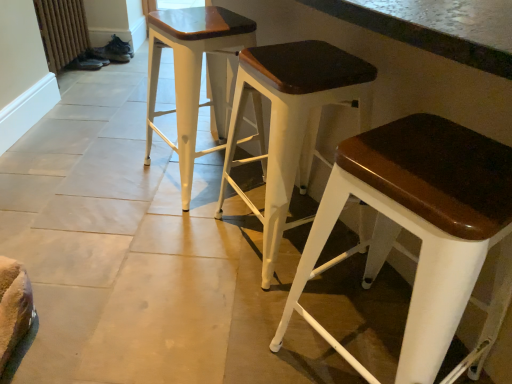
The height and width of the screenshot is (384, 512). Find the location of `rustic wood radiator at lower left`. rustic wood radiator at lower left is located at coordinates (62, 31).

What do you see at coordinates (194, 75) in the screenshot?
I see `white wood stool at center, the first stool when ordered from left to right` at bounding box center [194, 75].

Image resolution: width=512 pixels, height=384 pixels. What are the coordinates of `white wood stool at center, the 3th stool in the left-to-right sequence` in the screenshot? It's located at (420, 229).

Does point (346, 143) come behind point (51, 1)?

No, it is not.

Measure the distance from white wood stool at center, the 3th stool in the left-to-right sequence, to rustic wood radiator at lower left.

white wood stool at center, the 3th stool in the left-to-right sequence, is 7.20 feet away from rustic wood radiator at lower left.

How many degrees apart are the facing directions of white wood stool at center, the 3th stool in the left-to-right sequence, and rustic wood radiator at lower left?

40.2 degrees.

Are white wood stool at center, the 3th stool in the left-to-right sequence, and rustic wood radiator at lower left located far from each other?

Yes.

Is white wood stool at center, the 3th stool in the right-to-left sequence, closer to camera compared to white wood stool at center, the 3th stool in the left-to-right sequence?

No, white wood stool at center, the 3th stool in the right-to-left sequence, is behind white wood stool at center, the 3th stool in the left-to-right sequence.

Find the location of `stool that is the 2nd one when counting forward from the white wood stool at center, the first stool when ordered from left to right`. stool that is the 2nd one when counting forward from the white wood stool at center, the first stool when ordered from left to right is located at coordinates (420, 229).

In the scene shown: Can you tell me how much white wood stool at center, the 3th stool in the right-to-left sequence, and white wood stool at center, the first stool viewed from the right, differ in facing direction?

2.34 degrees separate the facing orientations of white wood stool at center, the 3th stool in the right-to-left sequence, and white wood stool at center, the first stool viewed from the right.

Are white wood stool at center, the 3th stool in the right-to-left sequence, and white wood stool at center, the first stool viewed from the right, beside each other?

No, white wood stool at center, the 3th stool in the right-to-left sequence, is not in contact with white wood stool at center, the first stool viewed from the right.

Between matte white stool at center, which is the second stool from left to right, and white wood stool at center, the first stool viewed from the right, which one has less height?

white wood stool at center, the first stool viewed from the right.

Is point (314, 66) positioned behind point (444, 261)?

That is True.

From the image's perspective, is matte white stool at center, acting as the 2th stool starting from the right, under white wood stool at center, the 3th stool in the left-to-right sequence?

Incorrect, from the image's perspective, matte white stool at center, acting as the 2th stool starting from the right, is higher than white wood stool at center, the 3th stool in the left-to-right sequence.

From a real-world perspective, is matte white stool at center, acting as the 2th stool starting from the right, on white wood stool at center, the first stool viewed from the right?

Yes, from a real-world perspective, matte white stool at center, acting as the 2th stool starting from the right, is over white wood stool at center, the first stool viewed from the right

From a real-world perspective, is white wood stool at center, the first stool viewed from the right, located higher than matte white stool at center, acting as the 2th stool starting from the right?

No, from a real-world perspective, white wood stool at center, the first stool viewed from the right, is not over matte white stool at center, acting as the 2th stool starting from the right

Between white wood stool at center, the 3th stool in the left-to-right sequence, and matte white stool at center, which is the second stool from left to right, which one has larger width?

Wider between the two is white wood stool at center, the 3th stool in the left-to-right sequence.

Consider the image. Is white wood stool at center, the first stool viewed from the right, positioned with its back to matte white stool at center, acting as the 2th stool starting from the right?

No, matte white stool at center, acting as the 2th stool starting from the right, is not at the back of white wood stool at center, the first stool viewed from the right.

Would you say white wood stool at center, the 3th stool in the left-to-right sequence, is outside matte white stool at center, which is the second stool from left to right?

That's correct, white wood stool at center, the 3th stool in the left-to-right sequence, is outside of matte white stool at center, which is the second stool from left to right.

Can you confirm if rustic wood radiator at lower left is thinner than white wood stool at center, the first stool viewed from the right?

Correct, the width of rustic wood radiator at lower left is less than that of white wood stool at center, the first stool viewed from the right.

From a real-world perspective, which is physically above, rustic wood radiator at lower left or white wood stool at center, the 3th stool in the left-to-right sequence?

In real-world perspective, white wood stool at center, the 3th stool in the left-to-right sequence, is above.

Considering the sizes of objects rustic wood radiator at lower left and white wood stool at center, the 3th stool in the left-to-right sequence, in the image provided, who is taller, rustic wood radiator at lower left or white wood stool at center, the 3th stool in the left-to-right sequence,?

white wood stool at center, the 3th stool in the left-to-right sequence, is taller.

Locate an element on the screen. radiator located behind the white wood stool at center, the first stool viewed from the right is located at coordinates (62, 31).

In the scene shown: Is white wood stool at center, the first stool viewed from the right, oriented away from white wood stool at center, the first stool when ordered from left to right?

No, white wood stool at center, the first stool viewed from the right, is not facing the opposite direction of white wood stool at center, the first stool when ordered from left to right.

Considering the positions of objects white wood stool at center, the first stool viewed from the right, and white wood stool at center, the first stool when ordered from left to right, in the image provided, who is in front, white wood stool at center, the first stool viewed from the right, or white wood stool at center, the first stool when ordered from left to right,?

white wood stool at center, the first stool viewed from the right, is in front.

Measure the distance from white wood stool at center, the first stool viewed from the right, to white wood stool at center, the first stool when ordered from left to right.

33.50 inches.

From a real-world perspective, is rustic wood radiator at lower left positioned over matte white stool at center, which is the second stool from left to right, based on gravity?

Incorrect, from a real-world perspective, rustic wood radiator at lower left is lower than matte white stool at center, which is the second stool from left to right.

Which object is closer to the camera, rustic wood radiator at lower left or matte white stool at center, which is the second stool from left to right?

matte white stool at center, which is the second stool from left to right, is closer to the camera.

From the picture: Is rustic wood radiator at lower left located outside matte white stool at center, which is the second stool from left to right?

That's correct, rustic wood radiator at lower left is outside of matte white stool at center, which is the second stool from left to right.

Which of these two, rustic wood radiator at lower left or matte white stool at center, which is the second stool from left to right, is wider?

Wider between the two is matte white stool at center, which is the second stool from left to right.

You are a GUI agent. You are given a task and a screenshot of the screen. Output one action in this format:
    pyautogui.click(x=<x>, y=<y>)
    Task: Click on the 1st stool above the rustic wood radiator at lower left (from a real-world perspective)
    The width and height of the screenshot is (512, 384).
    Given the screenshot: What is the action you would take?
    pyautogui.click(x=420, y=229)

Identify the location of the 2nd stool above the white wood stool at center, the first stool viewed from the right (from the image's perspective). The image size is (512, 384). (194, 75).

Considering their positions, is matte white stool at center, which is the second stool from left to right, positioned further to rustic wood radiator at lower left than white wood stool at center, the 3th stool in the right-to-left sequence?

matte white stool at center, which is the second stool from left to right, is positioned further to the anchor rustic wood radiator at lower left.

Based on their spatial positions, is white wood stool at center, the 3th stool in the left-to-right sequence, or white wood stool at center, the 3th stool in the right-to-left sequence, closer to rustic wood radiator at lower left?

white wood stool at center, the 3th stool in the right-to-left sequence, lies closer to rustic wood radiator at lower left than the other object.

When comparing their distances from white wood stool at center, the first stool when ordered from left to right, does matte white stool at center, which is the second stool from left to right, or white wood stool at center, the first stool viewed from the right, seem further?

The object further to white wood stool at center, the first stool when ordered from left to right, is white wood stool at center, the first stool viewed from the right.

When comparing their distances from matte white stool at center, acting as the 2th stool starting from the right, does white wood stool at center, the first stool when ordered from left to right, or rustic wood radiator at lower left seem further?

rustic wood radiator at lower left lies further to matte white stool at center, acting as the 2th stool starting from the right, than the other object.

From the image, which object appears to be farther from matte white stool at center, which is the second stool from left to right, white wood stool at center, the 3th stool in the left-to-right sequence, or rustic wood radiator at lower left?

The object further to matte white stool at center, which is the second stool from left to right, is rustic wood radiator at lower left.

Based on their spatial positions, is rustic wood radiator at lower left or white wood stool at center, the 3th stool in the left-to-right sequence, closer to white wood stool at center, the 3th stool in the right-to-left sequence?

white wood stool at center, the 3th stool in the left-to-right sequence.

From the image, which object appears to be nearer to white wood stool at center, the first stool when ordered from left to right, white wood stool at center, the 3th stool in the left-to-right sequence, or rustic wood radiator at lower left?

Based on the image, white wood stool at center, the 3th stool in the left-to-right sequence, appears to be nearer to white wood stool at center, the first stool when ordered from left to right.

When comparing their distances from matte white stool at center, which is the second stool from left to right, does white wood stool at center, the first stool when ordered from left to right, or white wood stool at center, the 3th stool in the left-to-right sequence, seem closer?

white wood stool at center, the first stool when ordered from left to right, lies closer to matte white stool at center, which is the second stool from left to right, than the other object.

Image resolution: width=512 pixels, height=384 pixels. Identify the location of stool between rustic wood radiator at lower left and matte white stool at center, acting as the 2th stool starting from the right. (194, 75).

I want to click on stool between white wood stool at center, the first stool viewed from the right, and white wood stool at center, the 3th stool in the right-to-left sequence, from front to back, so click(291, 123).